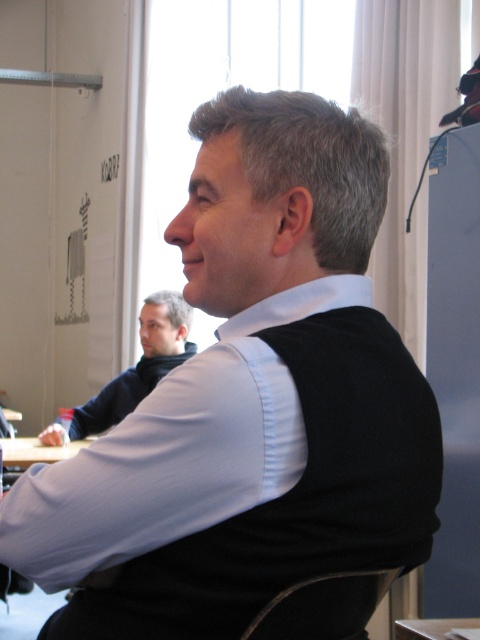
You are organizing a small event and need to place a decorative centerpiece on the white wood table at lower left. Considering the size of the dark blue sweater at center, will it fit on the table without overhanging the edges?

The dark blue sweater at center is bigger than the white wood table at lower left, so it will not fit without overhanging the edges.

You are a furniture designer who wants to ensure that the seating is comfortable for both users. Considering the black leather chair at lower center and the white wood table at lower left, which object is taller and might require adjusting the table height for ergonomic purposes?

The black leather chair at lower center is taller than the white wood table at lower left, so adjusting the table height might be necessary for ergonomic comfort.

You are standing at the center of the room and want to place a small plant on the white wood table at lower left. To reach the table, should you walk towards the left or right side of the room?

Since the white wood table at lower left is located at point 0.705 on the x and 0.077 on the y coordinate, you should walk towards the left side of the room to reach it.